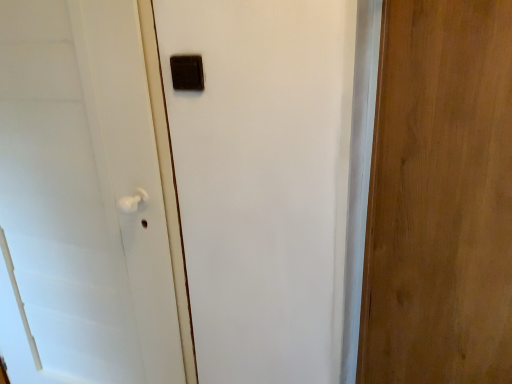
Question: In terms of size, does wooden door at right, the 2th door when ordered from left to right, appear bigger or smaller than matte brown switch at upper center?

Choices:
 (A) big
 (B) small

Answer: (A)

Question: Does point (362, 319) appear closer or farther from the camera than point (186, 57)?

Choices:
 (A) closer
 (B) farther

Answer: (B)

Question: Which object is the closest to the wooden door at right, the 2th door when ordered from left to right?

Choices:
 (A) matte brown switch at upper center
 (B) white matte door handle at left, the second door in the right-to-left sequence

Answer: (A)

Question: Which of these objects is positioned farthest from the white matte door handle at left, the second door in the right-to-left sequence?

Choices:
 (A) wooden door at right, the 2th door when ordered from left to right
 (B) matte brown switch at upper center

Answer: (A)